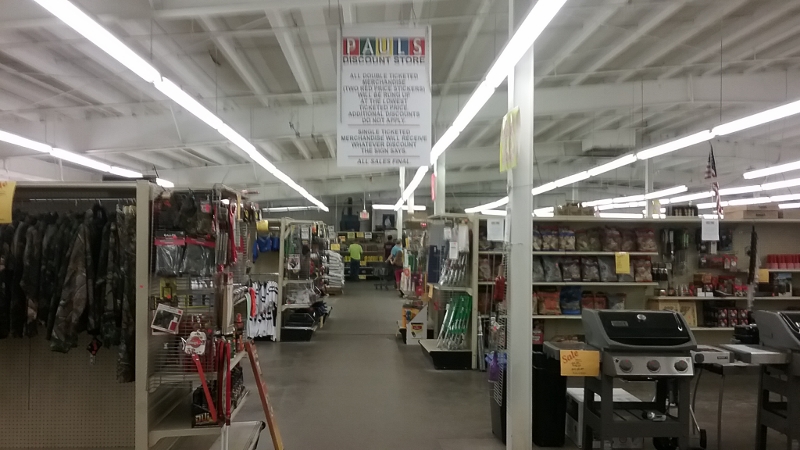
The width and height of the screenshot is (800, 450). Identify the location of clothing rack. (58, 202).